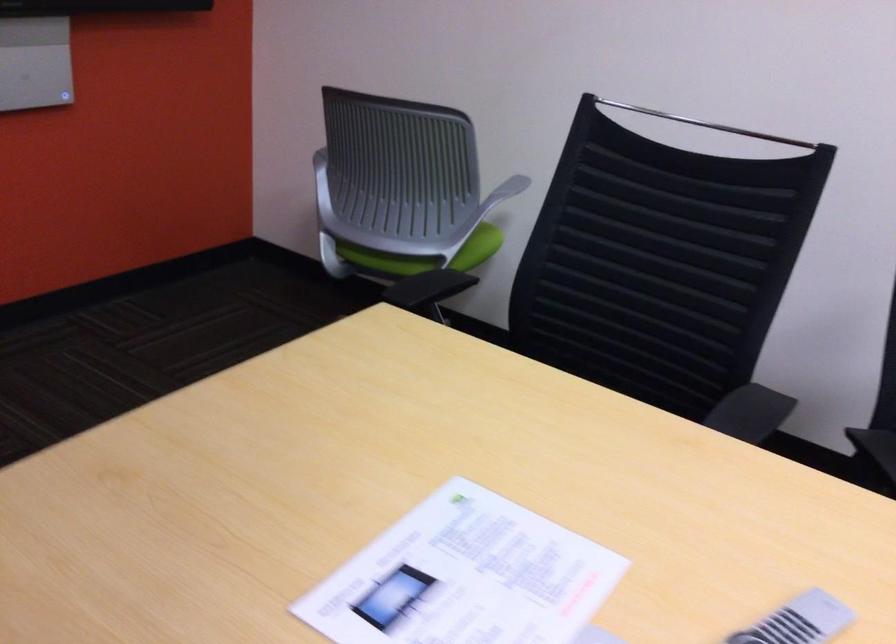
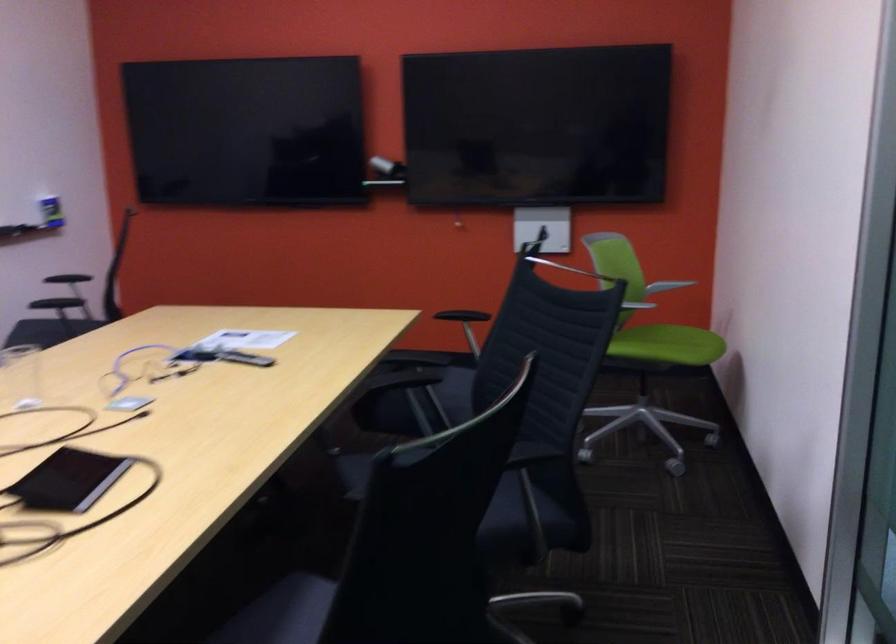
Where in the second image is the point corresponding to point 494,234 from the first image?

(667, 345)